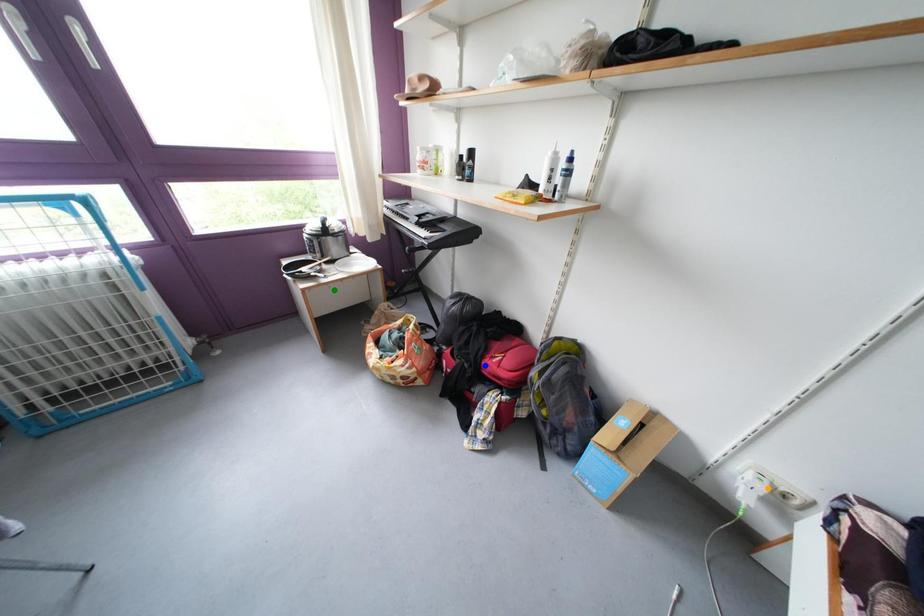
In the scene shown: Order these from nearest to farthest:
A) green point
B) blue point
C) orange point

1. green point
2. blue point
3. orange point